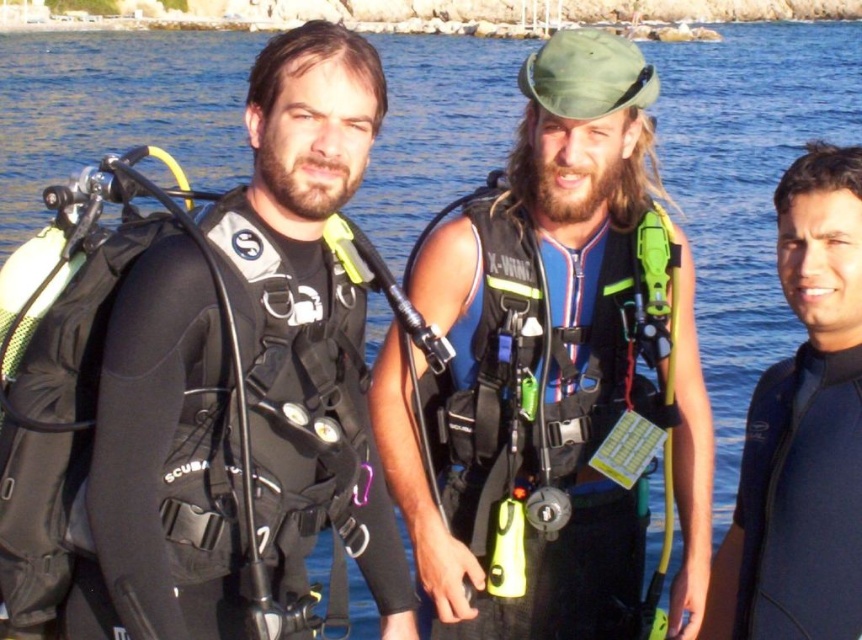
You are a scuba diving instructor observing the scene. You need to check the equipment of the two divers wearing the matte black wetsuit at center and the black matte wetsuit at right. Which diver is positioned to your left?

The matte black wetsuit at center is positioned to the left of the black matte wetsuit at right, so the diver in the matte black wetsuit at center is to your left.

You are a scuba diving instructor observing two divers preparing for a dive. You see the matte black wetsuit at center and the black matte wetsuit at left. Which diver is closer to you?

The matte black wetsuit at center is closer to you because it is further to the viewer than the black matte wetsuit at left.